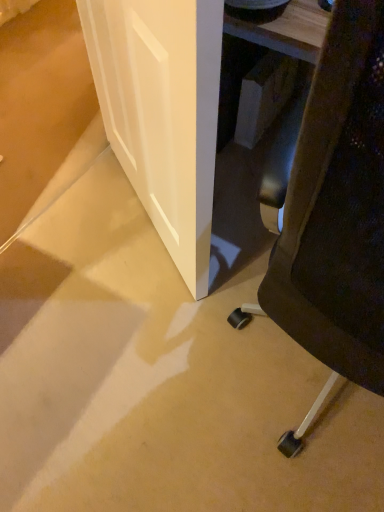
Find the location of a particular element. The height and width of the screenshot is (512, 384). white glossy door at center is located at coordinates (162, 112).

This screenshot has width=384, height=512. What do you see at coordinates (162, 112) in the screenshot? I see `white glossy door at center` at bounding box center [162, 112].

In order to click on white glossy door at center in this screenshot , I will do `click(162, 112)`.